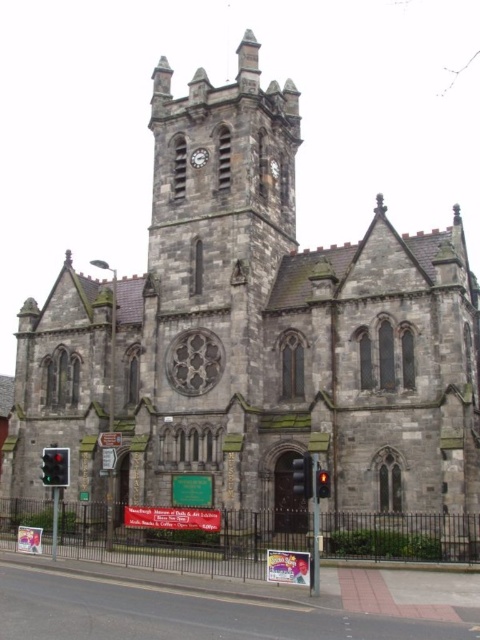
Can you confirm if red glass traffic light at lower center is shorter than metallic clock face at upper center?

In fact, red glass traffic light at lower center may be taller than metallic clock face at upper center.

Is point (309, 490) farther from camera compared to point (204, 152)?

That is False.

Find the location of `red glass traffic light at lower center`. red glass traffic light at lower center is located at coordinates (302, 476).

Can you confirm if red glass traffic light at center is positioned below metallic clock at upper center?

Indeed, red glass traffic light at center is positioned under metallic clock at upper center.

Can you confirm if red glass traffic light at center is wider than metallic clock at upper center?

Indeed, red glass traffic light at center has a greater width compared to metallic clock at upper center.

Identify the location of red glass traffic light at center. The image size is (480, 640). (323, 483).

Between red glass traffic light at lower center and red glass traffic light at center, which one appears on the right side from the viewer's perspective?

From the viewer's perspective, red glass traffic light at center appears more on the right side.

Is point (312, 493) in front of point (316, 477)?

Yes, it is in front of point (316, 477).

Is point (301, 476) closer to camera compared to point (319, 468)?

Yes.

Identify the location of red glass traffic light at lower center. coord(302,476).